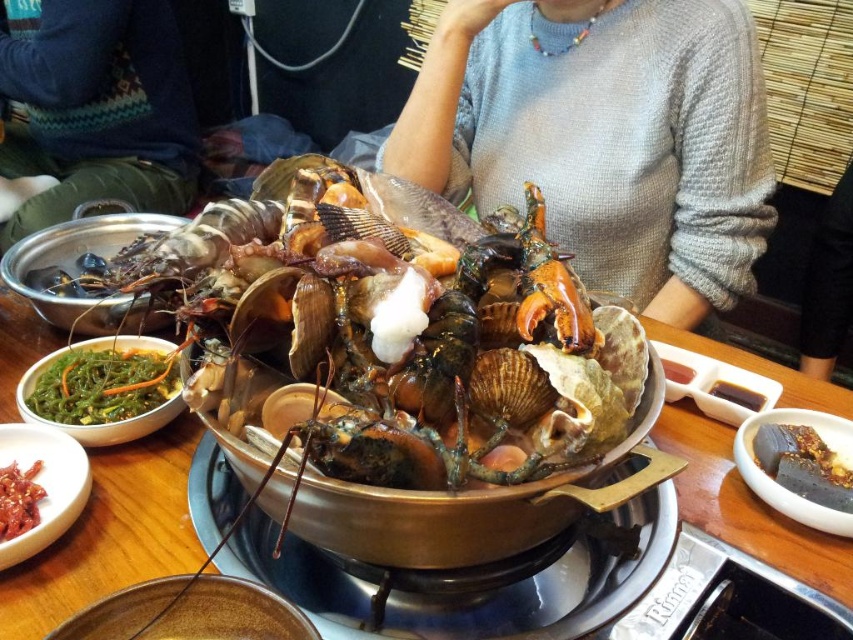
You are sitting at the table and want to reach for the seaweed dish. You notice two points on the table surface. Which point is closer to you, point at coordinate (747, 173) or point at coordinate (811, 468)?

Point at coordinate (747, 173) is closer to you than point at coordinate (811, 468) because it is further to the viewer.